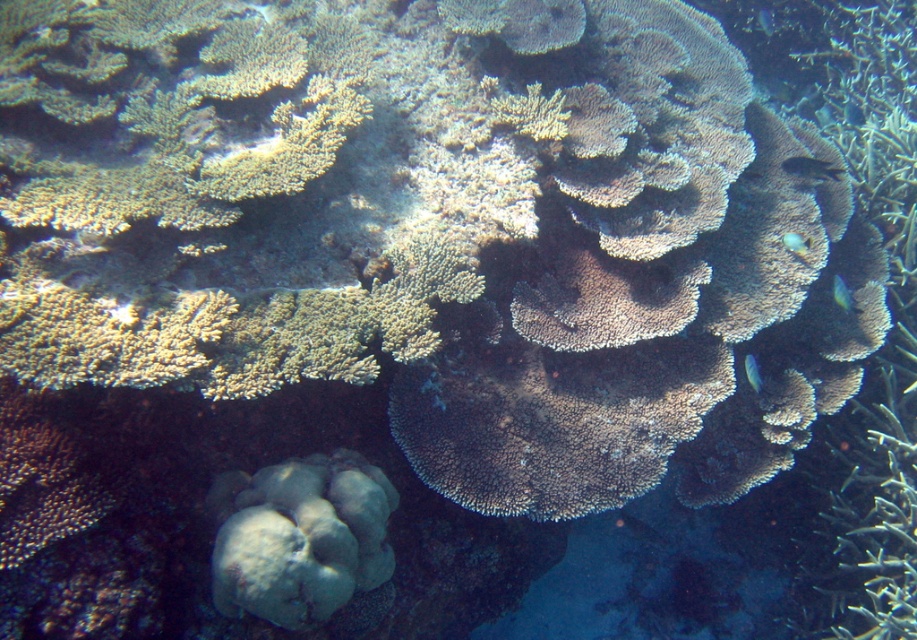
You are a marine biologist observing an underwater scene. You notice a blue glossy fish at right. Can you determine its exact 2D coordinates in the image?

The blue glossy fish at right is located at the 2D coordinates of point (794, 243).

You are a marine biologist observing an underwater scene. You notice a point marked at coordinates (794, 243). What object is located at this point?

The point at coordinates (794, 243) indicates a blue glossy fish at right.